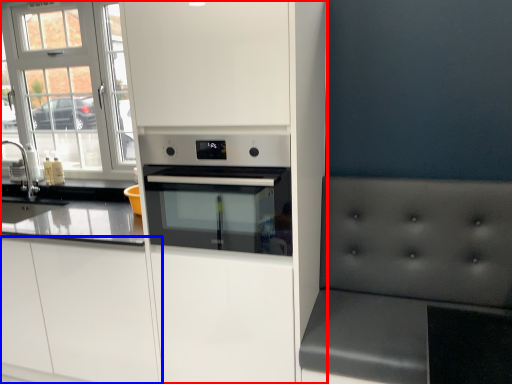
Question: Which object is closer to the camera taking this photo, cabinetry (highlighted by a red box) or cabinetry (highlighted by a blue box)?

Choices:
 (A) cabinetry
 (B) cabinetry

Answer: (A)